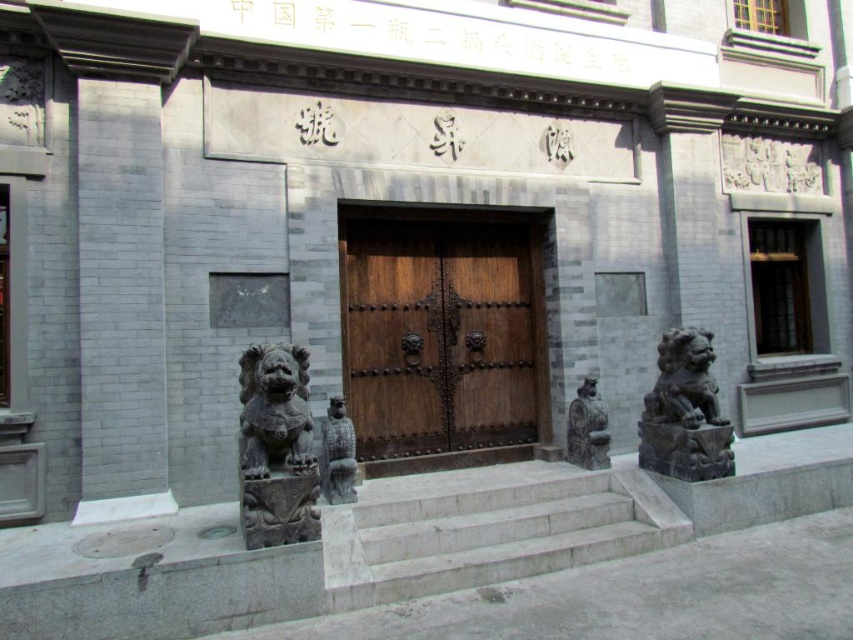
You are standing at the entrance of the traditional Chinese building and want to take a closer look at the dark gray stone lion at right and the dark gray stone lion at center. Which one do you need to walk towards first to get closer?

You need to walk towards the dark gray stone lion at right first because it is closer to you than the dark gray stone lion at center, so you can reach it sooner.

You are standing at the entrance of a traditional Chinese building and want to locate the wooden door at center. According to the coordinates provided, where exactly is the wooden door positioned?

The wooden door at center is located at point (440, 336).